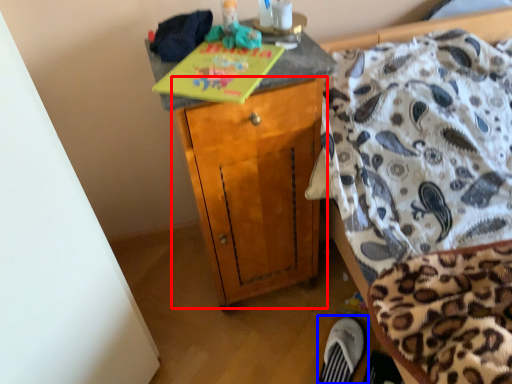
Question: Which object appears closest to the camera in this image, cabinetry (highlighted by a red box) or footwear (highlighted by a blue box)?

Choices:
 (A) cabinetry
 (B) footwear

Answer: (A)